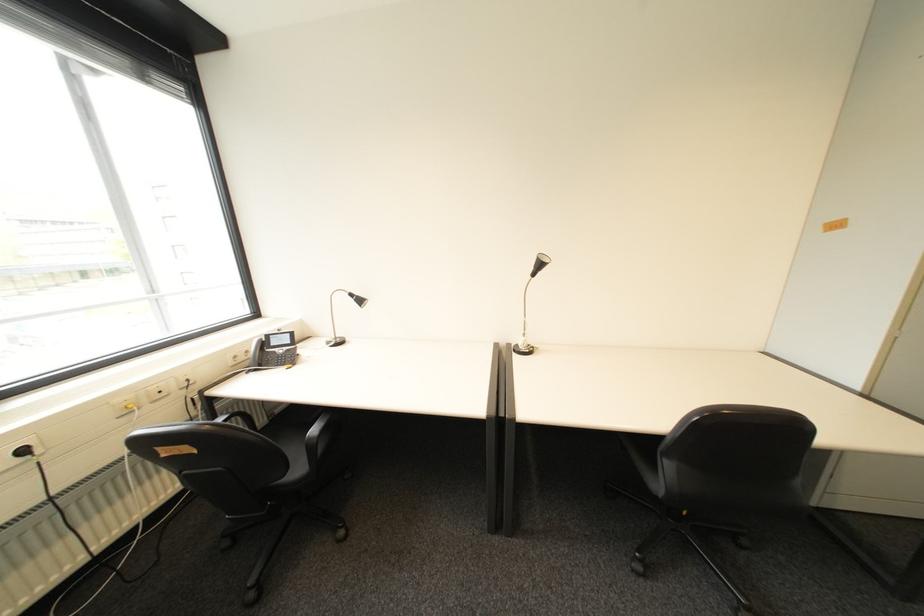
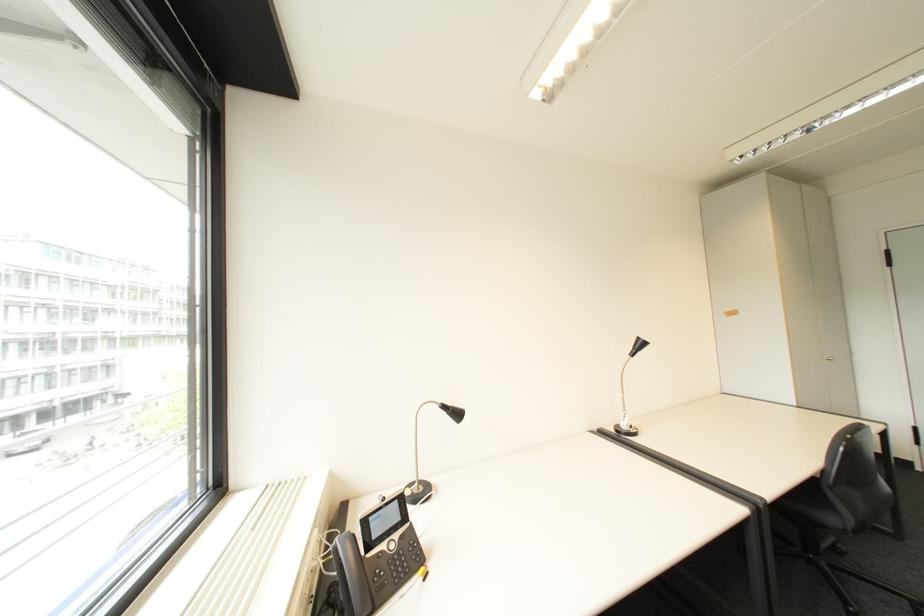
Locate, in the second image, the point that corresponds to (541,269) in the first image.

(640, 350)